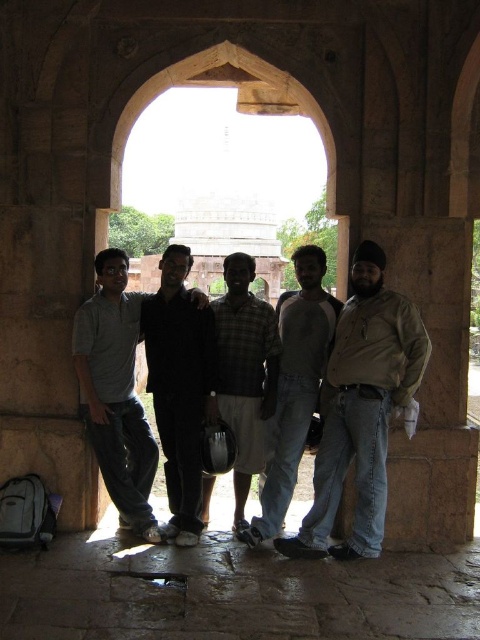
Is dark gray cotton shirt at center above checkered fabric shirt at center?

Yes.

Is dark gray cotton shirt at center shorter than checkered fabric shirt at center?

In fact, dark gray cotton shirt at center may be taller than checkered fabric shirt at center.

Find the location of a particular element. dark gray cotton shirt at center is located at coordinates (180, 387).

Is brown leather jacket at center to the right of dark gray jeans at center from the viewer's perspective?

Indeed, brown leather jacket at center is positioned on the right side of dark gray jeans at center.

Who is more distant from viewer, [316,556] or [120,260]?

The point [120,260] is more distant.

Which is behind, point (384, 465) or point (118, 307)?

The point (118, 307) is more distant.

Locate an element on the screen. The height and width of the screenshot is (640, 480). brown leather jacket at center is located at coordinates (361, 408).

Does dark gray cotton shirt at center come in front of light gray cotton pants at center?

No, dark gray cotton shirt at center is behind light gray cotton pants at center.

Which is more to the right, dark gray cotton shirt at center or light gray cotton pants at center?

light gray cotton pants at center is more to the right.

The height and width of the screenshot is (640, 480). Describe the element at coordinates (180, 387) in the screenshot. I see `dark gray cotton shirt at center` at that location.

Locate an element on the screen. The width and height of the screenshot is (480, 640). dark gray cotton shirt at center is located at coordinates (180, 387).